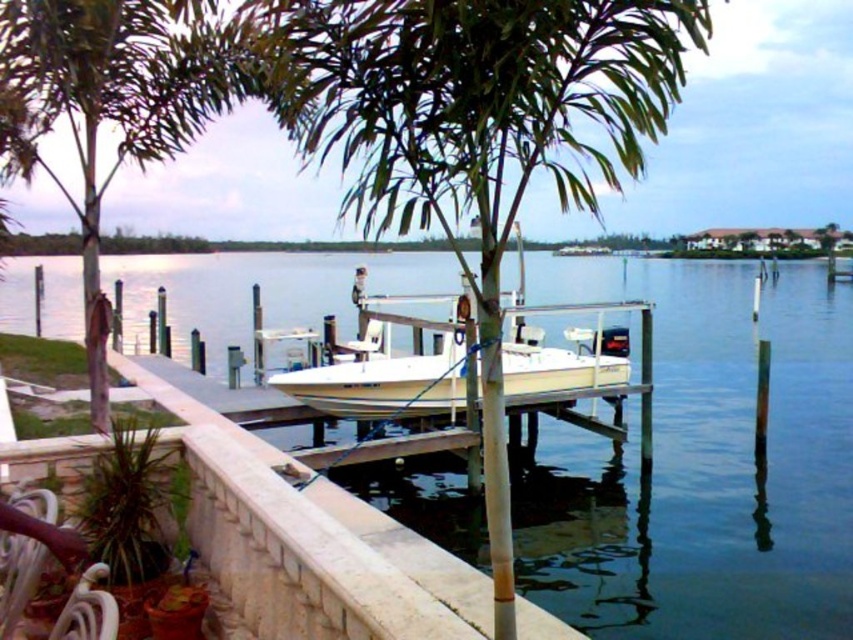
Consider the image. You are standing on the dock and looking at two points in the water. The first point is at coordinates point (503, 470) and the second point is at point (421, 356). Which point is closer to you?

Point (503, 470) is closer to the camera than point (421, 356), so the first point is closer to you.

You are standing on the wooden dock and want to know where the point with coordinates [701,465] is located. Is it on the wooden dock or on the clear blue water at center?

The point with coordinates [701,465] is on the clear blue water at center according to the description.

You are planning to take a photo of the white matte boat at center from the dock. Since the clear blue water at center is wider than the boat, where should you position yourself to ensure the boat is fully in the frame without any water cutting it off?

You should position yourself closer to the edge of the dock so that the white matte boat at center is centered in your viewfinder. Since the clear blue water at center is wider than the boat, this positioning ensures the boat remains fully within the frame while allowing some water space around it.